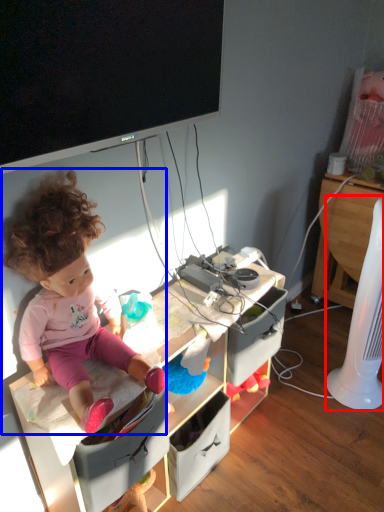
Question: Which of the following is the farthest to the observer, fan (highlighted by a red box) or person (highlighted by a blue box)?

Choices:
 (A) fan
 (B) person

Answer: (A)